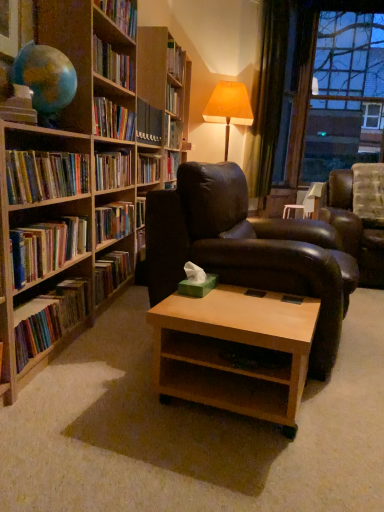
This screenshot has width=384, height=512. Find the location of `free space in front of light brown wood coffee table at center`. free space in front of light brown wood coffee table at center is located at coordinates (229, 464).